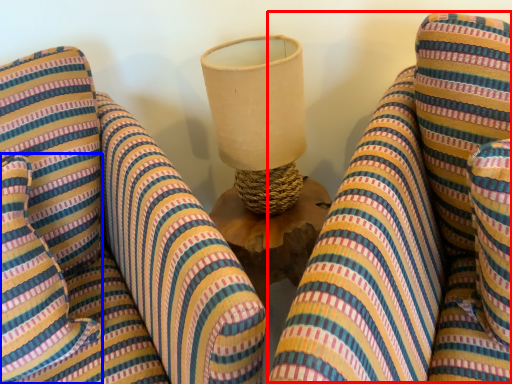
Question: Which point is closer to the camera, bean bag chair (highlighted by a red box) or pillow (highlighted by a blue box)?

Choices:
 (A) bean bag chair
 (B) pillow

Answer: (A)